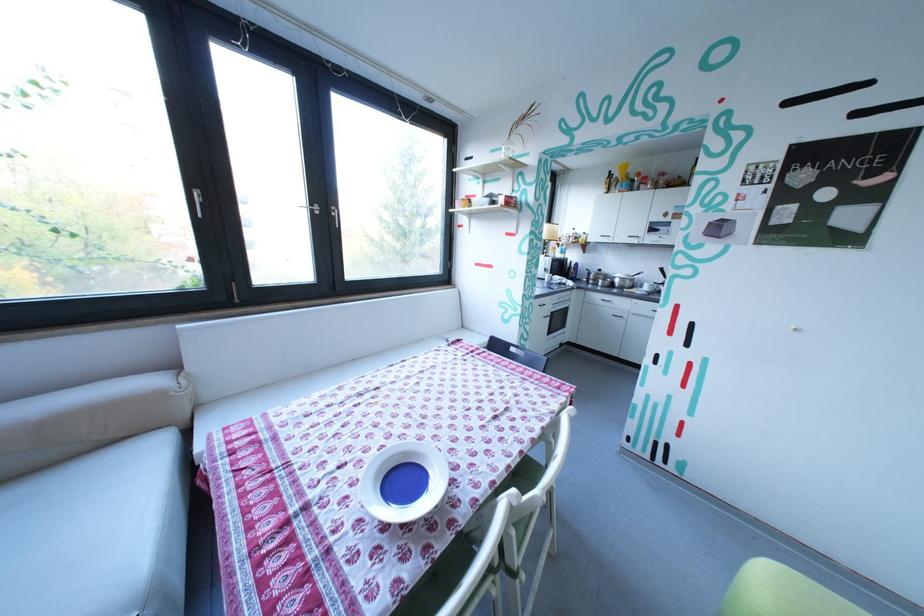
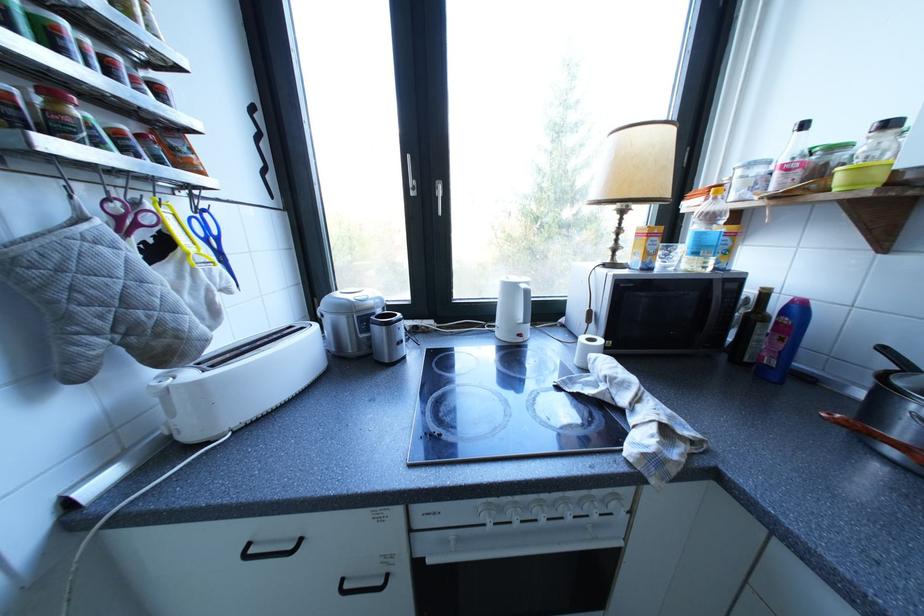
The point at (603, 282) is marked in the first image. Where is the corresponding point in the second image?

(907, 454)